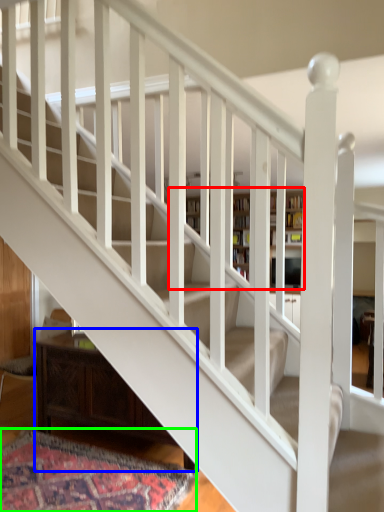
Question: Which object is positioned closest to bookcase (highlighted by a red box)? Select from furniture (highlighted by a blue box) and mat (highlighted by a green box).

Choices:
 (A) furniture
 (B) mat

Answer: (A)